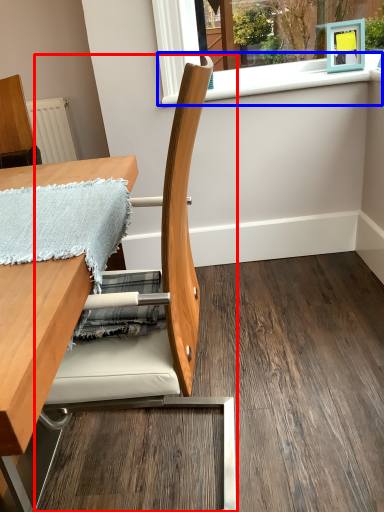
Question: Which object is further to the camera taking this photo, chair (highlighted by a red box) or window sill (highlighted by a blue box)?

Choices:
 (A) chair
 (B) window sill

Answer: (B)